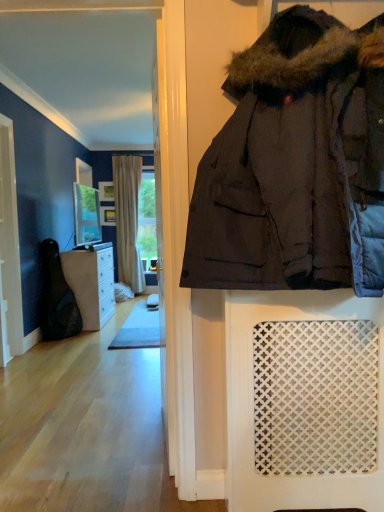
The image size is (384, 512). What are the coordinates of `white lattice mat at lower right` in the screenshot? It's located at (302, 402).

The image size is (384, 512). What do you see at coordinates (108, 216) in the screenshot? I see `wooden frame at center, which appears as the second picture frame when viewed from the top` at bounding box center [108, 216].

Image resolution: width=384 pixels, height=512 pixels. What do you see at coordinates (128, 219) in the screenshot?
I see `beige textured curtain at center` at bounding box center [128, 219].

I want to click on white wood screen door at left, so click(10, 244).

What do you see at coordinates (91, 283) in the screenshot? I see `brown wood cabinet at left` at bounding box center [91, 283].

The height and width of the screenshot is (512, 384). Identify the location of white lattice mat at lower right. (302, 402).

Looking at this image, how different are the orientations of dark brown puffy jacket at center and white wood screen door at left in degrees?

There is a 88.2-degree angle between the facing directions of dark brown puffy jacket at center and white wood screen door at left.

From the image's perspective, which one is positioned higher, dark brown puffy jacket at center or white wood screen door at left?

dark brown puffy jacket at center, from the image's perspective.

Does point (291, 181) lie in front of point (9, 230)?

Yes, point (291, 181) is closer to viewer.

Is dark brown puffy jacket at center situated inside white wood screen door at left or outside?

dark brown puffy jacket at center exists outside the volume of white wood screen door at left.

From a real-world perspective, is brown wood cabinet at left physically above wooden frame at center, placed as the 2th picture frame when sorted from bottom to top?

Incorrect, from a real-world perspective, brown wood cabinet at left is lower than wooden frame at center, placed as the 2th picture frame when sorted from bottom to top.

Is brown wood cabinet at left located outside wooden frame at center, marked as the 1th picture frame in a top-to-bottom arrangement?

That's correct, brown wood cabinet at left is outside of wooden frame at center, marked as the 1th picture frame in a top-to-bottom arrangement.

Considering the positions of point (97, 269) and point (100, 196), is point (97, 269) closer or farther from the camera than point (100, 196)?

Point (97, 269) appears to be closer to the viewer than point (100, 196).

Considering the sizes of objects wooden frame at center, which appears as the second picture frame when viewed from the top, and white lattice mat at lower right in the image provided, who is shorter, wooden frame at center, which appears as the second picture frame when viewed from the top, or white lattice mat at lower right?

Standing shorter between the two is wooden frame at center, which appears as the second picture frame when viewed from the top.

Is wooden frame at center, which appears as the second picture frame when viewed from the top, directly adjacent to white lattice mat at lower right?

They are not placed beside each other.

Is point (113, 214) positioned in front of point (250, 359)?

No, it is behind (250, 359).

Is wooden frame at center, arranged as the 1th picture frame when ordered from the bottom, oriented towards white lattice mat at lower right?

Yes, wooden frame at center, arranged as the 1th picture frame when ordered from the bottom, is oriented towards white lattice mat at lower right.

Can you confirm if brown wood cabinet at left is wider than matte glass mirror at upper center?

Yes.

Is the depth of brown wood cabinet at left greater than that of matte glass mirror at upper center?

Yes, the depth of brown wood cabinet at left is greater than that of matte glass mirror at upper center.

From the image's perspective, would you say brown wood cabinet at left is shown under matte glass mirror at upper center?

Yes.

Is point (112, 265) closer or farther from the camera than point (85, 202)?

Point (112, 265).

Which object is further away from the camera taking this photo, beige textured curtain at center or wooden frame at center, arranged as the 1th picture frame when ordered from the bottom?

wooden frame at center, arranged as the 1th picture frame when ordered from the bottom, is behind.

Considering the sizes of beige textured curtain at center and wooden frame at center, which appears as the second picture frame when viewed from the top, in the image, is beige textured curtain at center wider or thinner than wooden frame at center, which appears as the second picture frame when viewed from the top,?

Clearly, beige textured curtain at center has more width compared to wooden frame at center, which appears as the second picture frame when viewed from the top.

Is beige textured curtain at center with wooden frame at center, arranged as the 1th picture frame when ordered from the bottom?

They are not placed beside each other.

How many degrees apart are the facing directions of beige textured curtain at center and wooden frame at center, arranged as the 1th picture frame when ordered from the bottom?

The angular difference between beige textured curtain at center and wooden frame at center, arranged as the 1th picture frame when ordered from the bottom, is 0.000529 degrees.

Is beige textured curtain at center in front of or behind dark brown puffy jacket at center in the image?

beige textured curtain at center is positioned farther from the viewer than dark brown puffy jacket at center.

From a real-world perspective, is beige textured curtain at center above or below dark brown puffy jacket at center?

From a real-world perspective, beige textured curtain at center is physically below dark brown puffy jacket at center.

Between beige textured curtain at center and dark brown puffy jacket at center, which one has more height?

With more height is beige textured curtain at center.

In the image, there is a white lattice mat at lower right. Identify the location of cabinetry above it (from the image's perspective). This screenshot has width=384, height=512. (91, 283).

Considering the relative sizes of brown wood cabinet at left and white lattice mat at lower right in the image provided, is brown wood cabinet at left taller than white lattice mat at lower right?

Yes.

Is brown wood cabinet at left facing towards white lattice mat at lower right?

No, brown wood cabinet at left is not oriented towards white lattice mat at lower right.

Is brown wood cabinet at left at the left side of white lattice mat at lower right?

Indeed, brown wood cabinet at left is positioned on the left side of white lattice mat at lower right.

Locate an element on the screen. jacket above the white wood screen door at left (from the image's perspective) is located at coordinates 295,164.

The height and width of the screenshot is (512, 384). I want to click on cabinetry to the right of wooden frame at center, marked as the 1th picture frame in a top-to-bottom arrangement, so click(91, 283).

Looking at the image, which one is located further to beige textured curtain at center, brown wood cabinet at left or matte glass mirror at upper center?

Based on the image, brown wood cabinet at left appears to be further to beige textured curtain at center.

From the image, which object appears to be farther from brown wood cabinet at left, white lattice mat at lower right or wooden frame at center, arranged as the 1th picture frame when ordered from the bottom?

Based on the image, white lattice mat at lower right appears to be further to brown wood cabinet at left.

When comparing their distances from white wood screen door at left, does wooden frame at center, placed as the 2th picture frame when sorted from bottom to top, or beige textured curtain at center seem closer?

beige textured curtain at center.

Estimate the real-world distances between objects in this image. Which object is further from beige textured curtain at center, white wood screen door at left or white lattice mat at lower right?

white lattice mat at lower right lies further to beige textured curtain at center than the other object.

In the scene shown: From the image, which object appears to be farther from wooden frame at center, arranged as the 1th picture frame when ordered from the bottom, matte glass mirror at upper center or beige textured curtain at center?

beige textured curtain at center is positioned further to the anchor wooden frame at center, arranged as the 1th picture frame when ordered from the bottom.

From the image, which object appears to be nearer to matte glass mirror at upper center, white lattice mat at lower right or beige textured curtain at center?

beige textured curtain at center is closer to matte glass mirror at upper center.

Which object lies further to the anchor point brown wood cabinet at left, beige textured curtain at center or wooden frame at center, which appears as the second picture frame when viewed from the top?

wooden frame at center, which appears as the second picture frame when viewed from the top, lies further to brown wood cabinet at left than the other object.

Based on their spatial positions, is matte glass mirror at upper center or wooden frame at center, arranged as the 1th picture frame when ordered from the bottom, further from brown wood cabinet at left?

wooden frame at center, arranged as the 1th picture frame when ordered from the bottom, lies further to brown wood cabinet at left than the other object.

At what (x,y) coordinates should I click in order to perform the action: click on curtain between white wood screen door at left and wooden frame at center, which appears as the second picture frame when viewed from the top, from front to back. Please return your answer as a coordinate pair (x, y). The image size is (384, 512). Looking at the image, I should click on (128, 219).

Locate an element on the screen. The image size is (384, 512). cabinetry positioned between matte glass mirror at upper center and wooden frame at center, marked as the 1th picture frame in a top-to-bottom arrangement, from near to far is located at coordinates (91, 283).

Where is `cabinetry between white lattice mat at lower right and beige textured curtain at center from front to back`? Image resolution: width=384 pixels, height=512 pixels. cabinetry between white lattice mat at lower right and beige textured curtain at center from front to back is located at coordinates (91, 283).

Find the location of `furniture between dark brown puffy jacket at center and wooden frame at center, placed as the 2th picture frame when sorted from bottom to top, in the front-back direction`. furniture between dark brown puffy jacket at center and wooden frame at center, placed as the 2th picture frame when sorted from bottom to top, in the front-back direction is located at coordinates (302, 402).